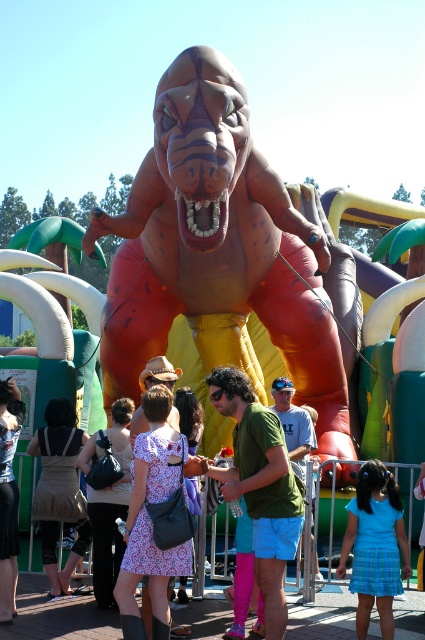
You are a photographer trying to capture a clear shot of both the blue plaid skirt at lower center and the khaki fabric skirt at center. Since you want to ensure both are visible, which skirt should you focus on first to avoid blurring due to their size?

The blue plaid skirt at lower center occupies less space than the khaki fabric skirt at center, so you should focus on the khaki fabric skirt at center first as it is larger and might require more attention to capture clearly.

Looking at this image, you are standing in front of the large inflatable dinosaur and notice two skirts in the scene. Which skirt, the blue plaid skirt at lower center or the khaki fabric skirt at center, is positioned closer to you?

The blue plaid skirt at lower center is closer to the viewer than the khaki fabric skirt at center.

You are standing at the center of the scene. Which direction should you move to locate the blue plaid skirt at lower center?

You should move downward and to the right to locate the blue plaid skirt at lower center since it is positioned at point 0.855 on the x axis and 0.882 on the y axis, which is lower and to the right from the center.